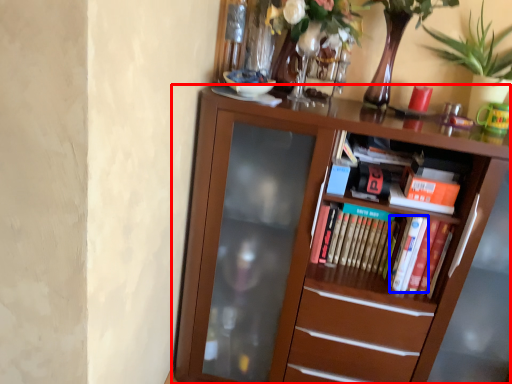
Question: Which of the following is the farthest to the observer, bookcase (highlighted by a red box) or paperback book (highlighted by a blue box)?

Choices:
 (A) bookcase
 (B) paperback book

Answer: (B)